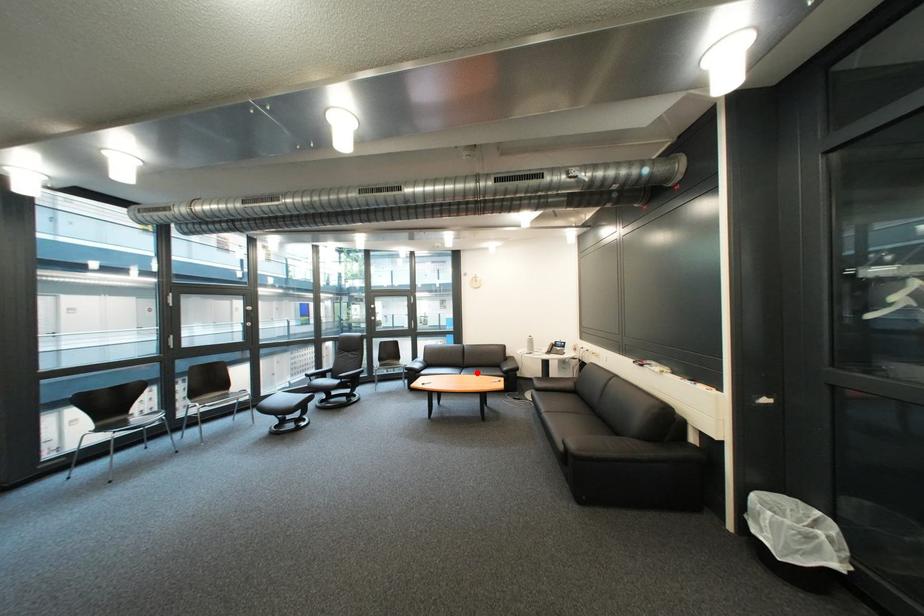
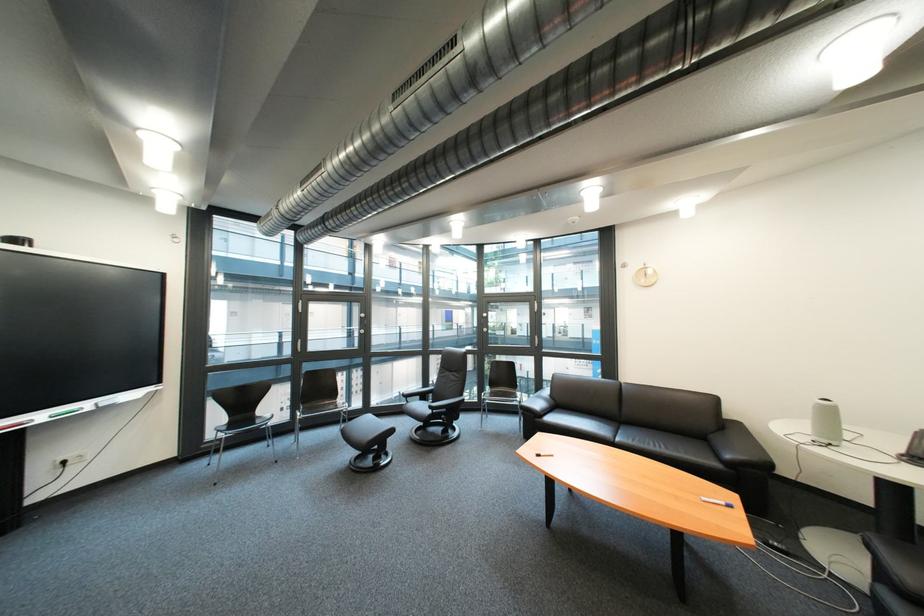
In the second image, find the point that corresponds to the highlighted location in the first image.

(634, 434)